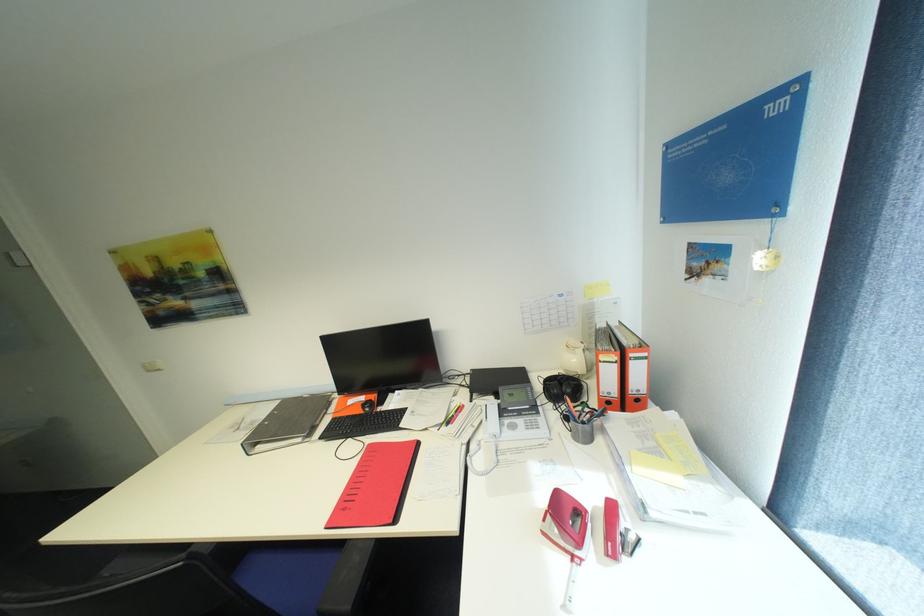
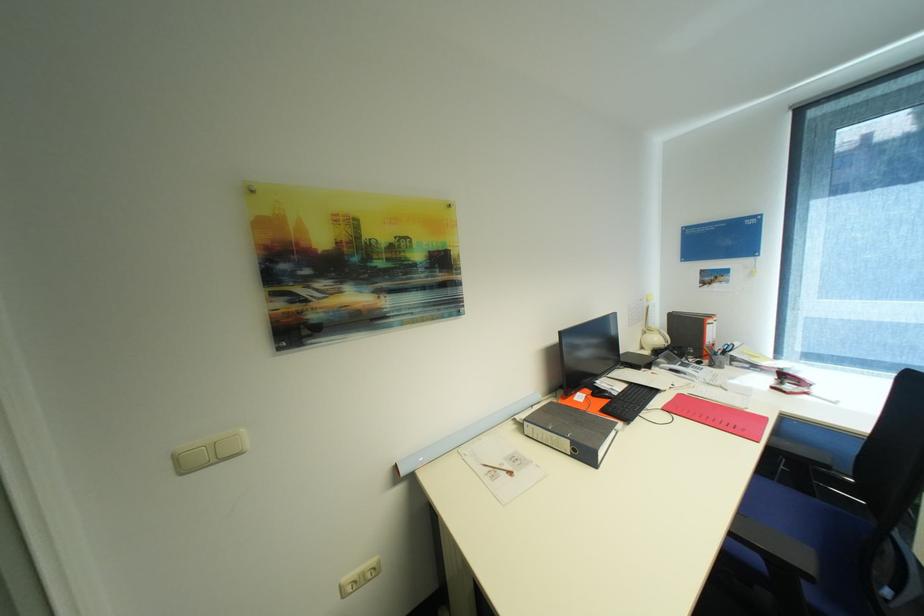
In the second image, find the point that corresponds to [582,361] in the first image.

(663, 339)